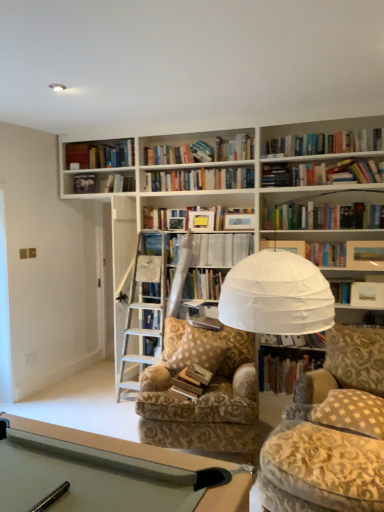
Question: Could hardcover book at center be considered to be inside patterned fabric chair at center?

Choices:
 (A) no
 (B) yes

Answer: (B)

Question: Is patterned fabric chair at center thinner than hardcover book at center?

Choices:
 (A) no
 (B) yes

Answer: (A)

Question: Considering the relative positions of patterned fabric chair at center and hardcover book at center in the image provided, is patterned fabric chair at center behind hardcover book at center?

Choices:
 (A) yes
 (B) no

Answer: (B)

Question: Does patterned fabric chair at center come in front of hardcover book at center?

Choices:
 (A) yes
 (B) no

Answer: (A)

Question: From a real-world perspective, does patterned fabric chair at center stand above hardcover book at center?

Choices:
 (A) yes
 (B) no

Answer: (B)

Question: From a real-world perspective, is patterned fabric chair at center physically below hardcover book at center?

Choices:
 (A) no
 (B) yes

Answer: (B)

Question: Does white paper book at upper center, marked as the second book in a top-to-bottom arrangement, lie in front of white checkered pillow at lower right, which is the 2th pillow from back to front?

Choices:
 (A) yes
 (B) no

Answer: (B)

Question: From a real-world perspective, is white paper book at upper center, which is the third book in bottom-to-top order, below white checkered pillow at lower right, arranged as the 1th pillow when viewed from the right?

Choices:
 (A) no
 (B) yes

Answer: (A)

Question: Can white checkered pillow at lower right, which is the 2th pillow from back to front, be found inside white paper book at upper center, marked as the second book in a top-to-bottom arrangement?

Choices:
 (A) yes
 (B) no

Answer: (B)

Question: Is white paper book at upper center, which is the third book in bottom-to-top order, aimed at white checkered pillow at lower right, arranged as the 1th pillow when viewed from the right?

Choices:
 (A) yes
 (B) no

Answer: (A)

Question: From the image's perspective, would you say white paper book at upper center, which is the third book in bottom-to-top order, is positioned over white checkered pillow at lower right, which is the 2th pillow from back to front?

Choices:
 (A) no
 (B) yes

Answer: (B)

Question: From a real-world perspective, does white paper book at upper center, which is the third book in bottom-to-top order, stand above white checkered pillow at lower right, which is the 2th pillow from back to front?

Choices:
 (A) no
 (B) yes

Answer: (B)

Question: Is brown checkered pillow at center, marked as the 2th pillow in a right-to-left arrangement, at the left side of hardcover book at center?

Choices:
 (A) no
 (B) yes

Answer: (B)